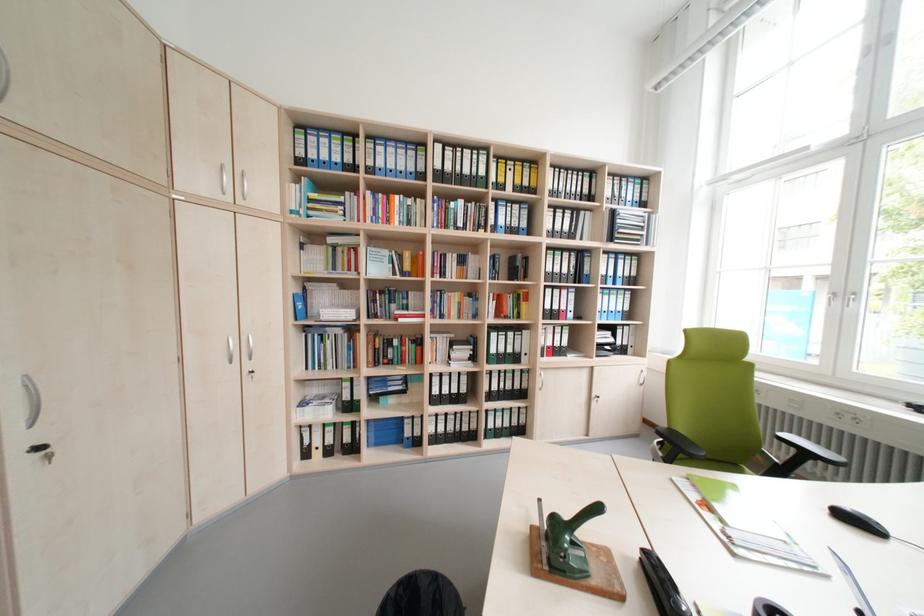
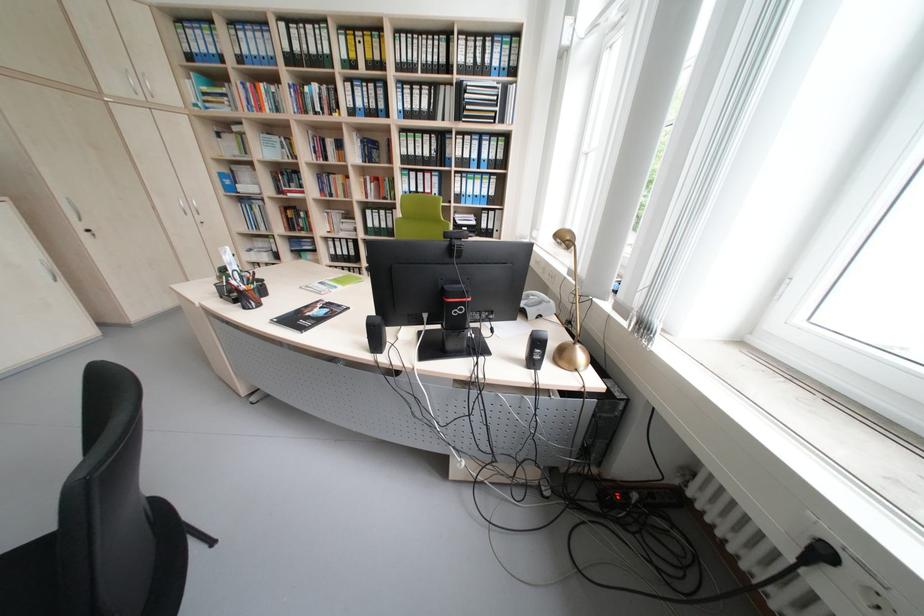
Locate, in the second image, the point that corresponds to point (322, 331) in the first image.

(253, 201)